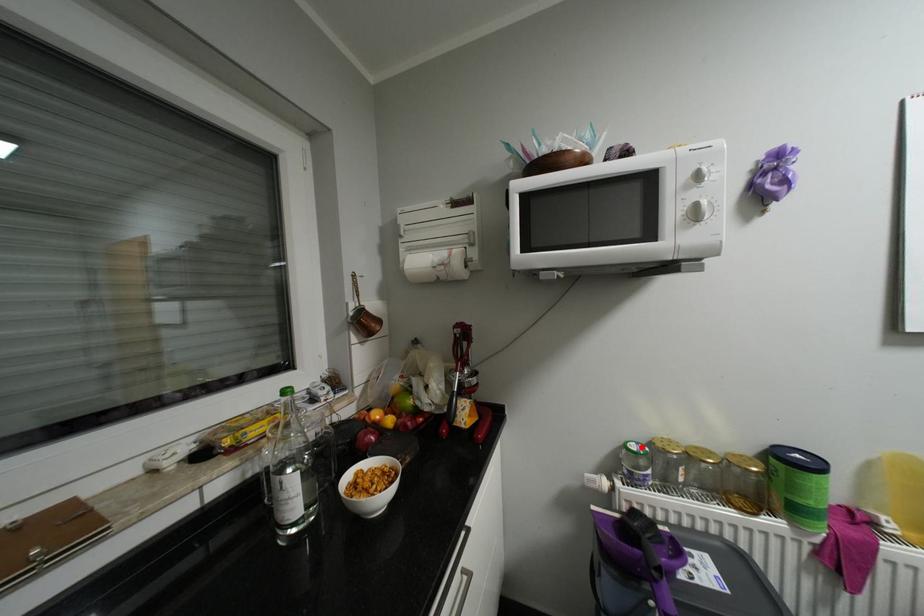
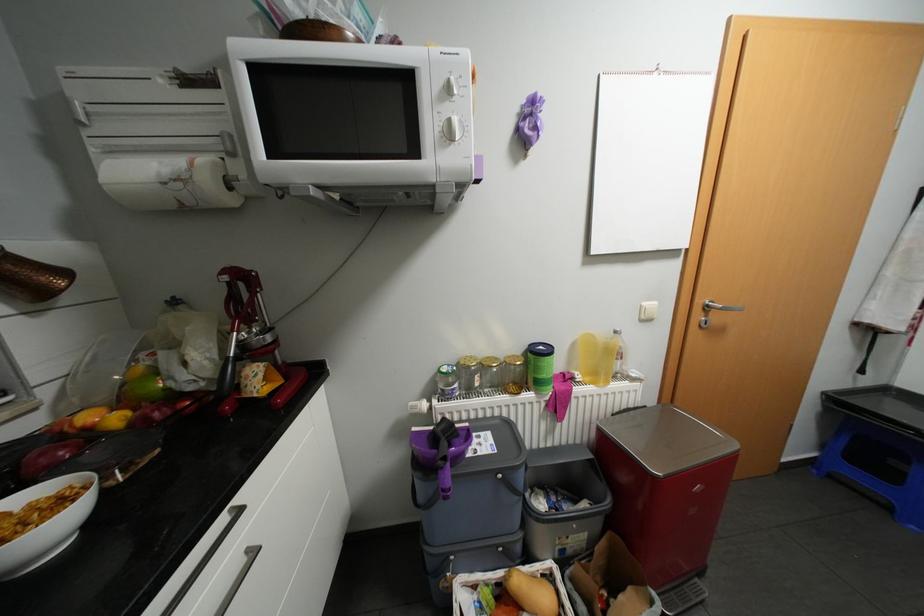
Find the pixel in the second image that matches the highlighted location in the first image.

(452, 369)